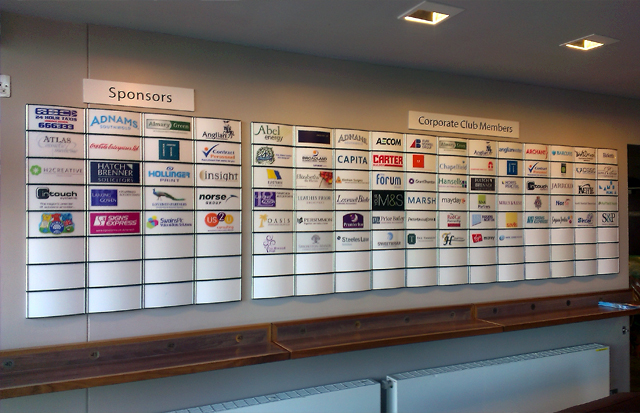
Locate an element on the screen. The image size is (640, 413). white walls is located at coordinates (377, 313), (58, 328).